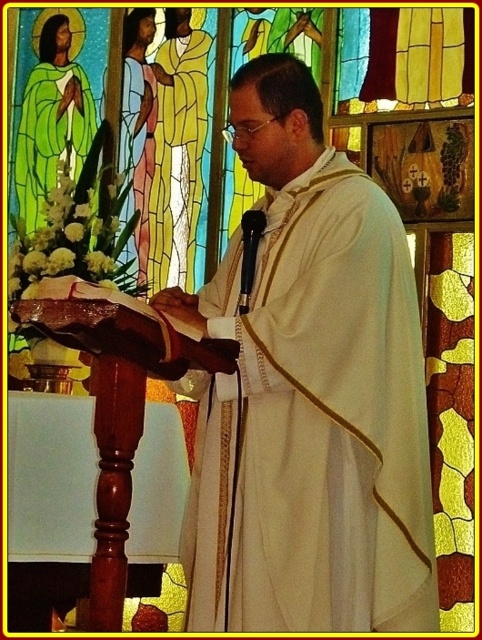
Question: Is the position of polished wood pulpit at center more distant than that of green matte robe at upper left?

Choices:
 (A) no
 (B) yes

Answer: (A)

Question: Which is nearer to the polished wood pulpit at center?

Choices:
 (A) yellow textured robe at center
 (B) matte gold robe at center

Answer: (A)

Question: Which point is farther to the camera?

Choices:
 (A) (136, 241)
 (B) (174, 163)

Answer: (A)

Question: From the image, what is the correct spatial relationship of white matte robe at center in relation to polished wood pulpit at center?

Choices:
 (A) right
 (B) left

Answer: (A)

Question: Considering the real-world distances, which object is closest to the white matte robe at center?

Choices:
 (A) polished wood pulpit at center
 (B) yellow textured robe at center
 (C) green matte robe at upper left

Answer: (A)

Question: Does polished wood pulpit at center appear under matte gold robe at center?

Choices:
 (A) no
 (B) yes

Answer: (B)